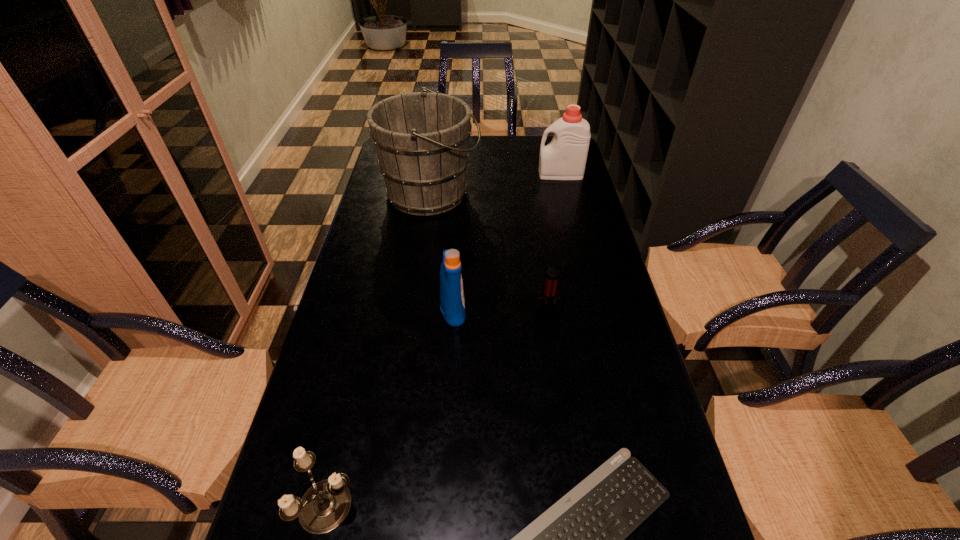
Where is `object situated at the left edge`? object situated at the left edge is located at coordinates (421, 138).

At what (x,y) coordinates should I click in order to perform the action: click on object that is at the right edge. Please return your answer as a coordinate pair (x, y). The width and height of the screenshot is (960, 540). Looking at the image, I should click on (564, 158).

In the image, there is a desktop. Identify the location of blank space at the far edge. (508, 142).

Find the location of a particular element. The width and height of the screenshot is (960, 540). free region at the left edge of the desktop is located at coordinates (344, 342).

In the image, there is a desktop. At what (x,y) coordinates should I click in order to perform the action: click on vacant space at the right edge. Please return your answer as a coordinate pair (x, y). This screenshot has height=540, width=960. Looking at the image, I should click on (561, 267).

Identify the location of empty space between the left detergent and the farther detergent. (507, 242).

Locate an element on the screen. This screenshot has height=540, width=960. unoccupied area between the microphone and the tallest object is located at coordinates (490, 255).

This screenshot has width=960, height=540. I want to click on free space between the tallest object and the farther detergent, so click(x=495, y=184).

This screenshot has height=540, width=960. Identify the location of object that stands as the second closest to the farther detergent. (546, 315).

Where is `object that ranks as the fourth closest to the left detergent`? object that ranks as the fourth closest to the left detergent is located at coordinates (325, 505).